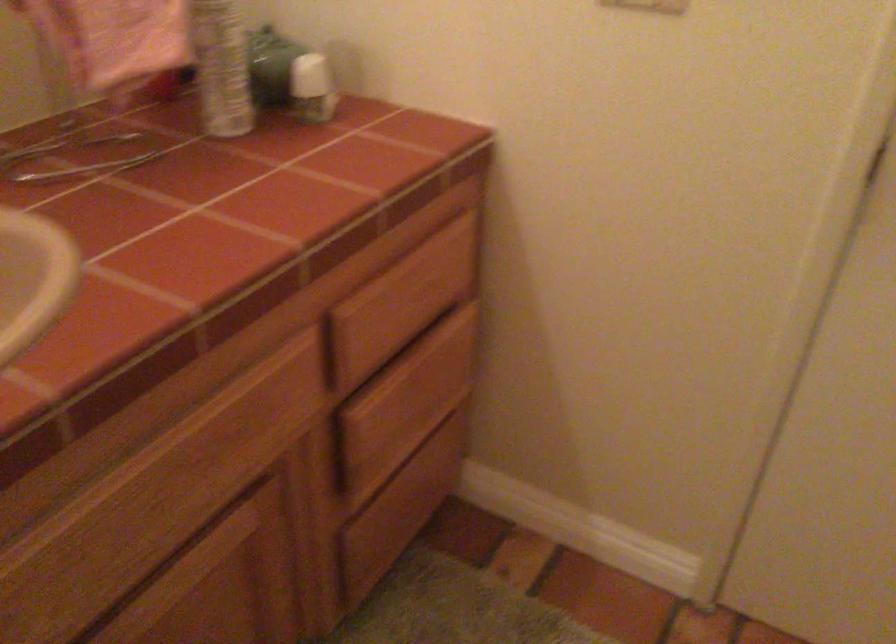
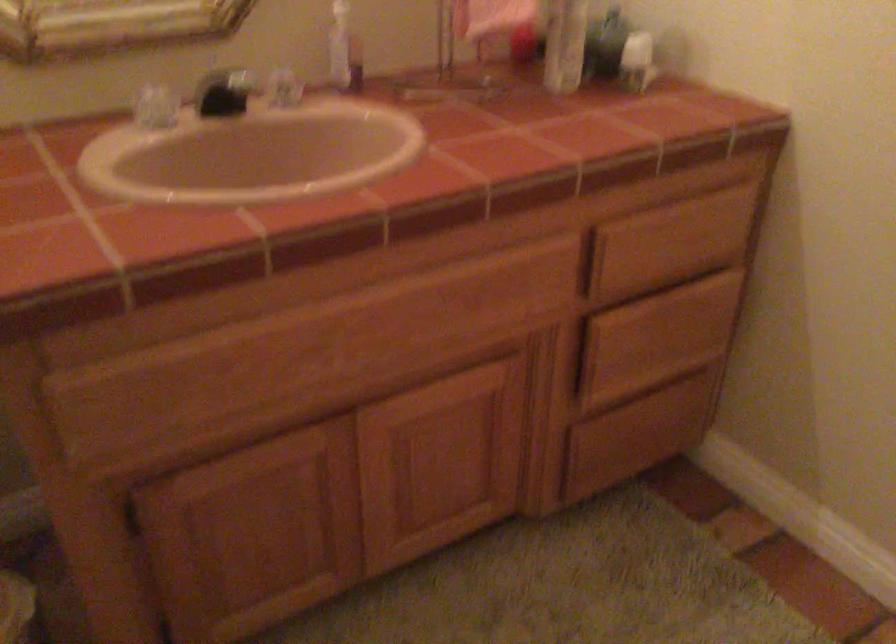
The point at [411,502] is marked in the first image. Where is the corresponding point in the second image?

(639, 433)